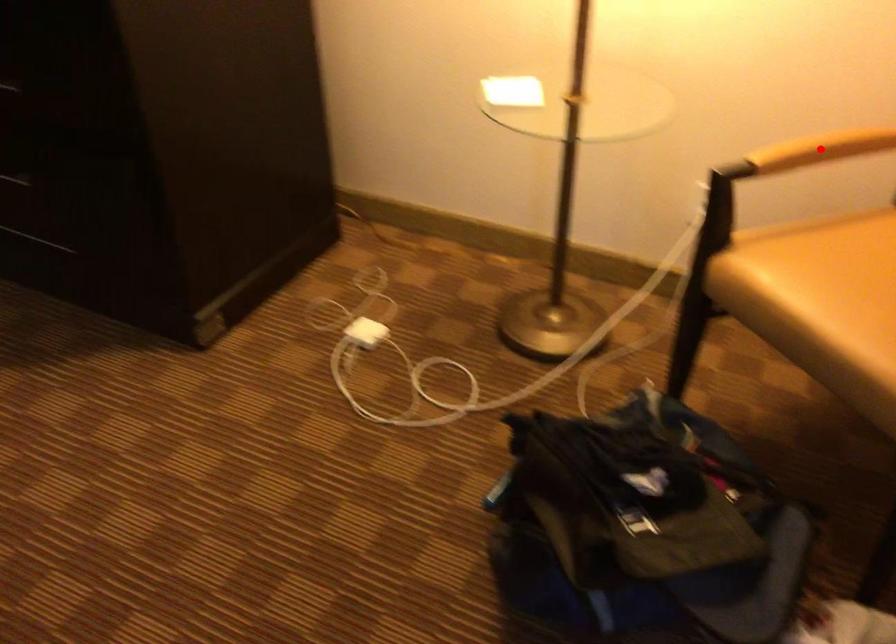
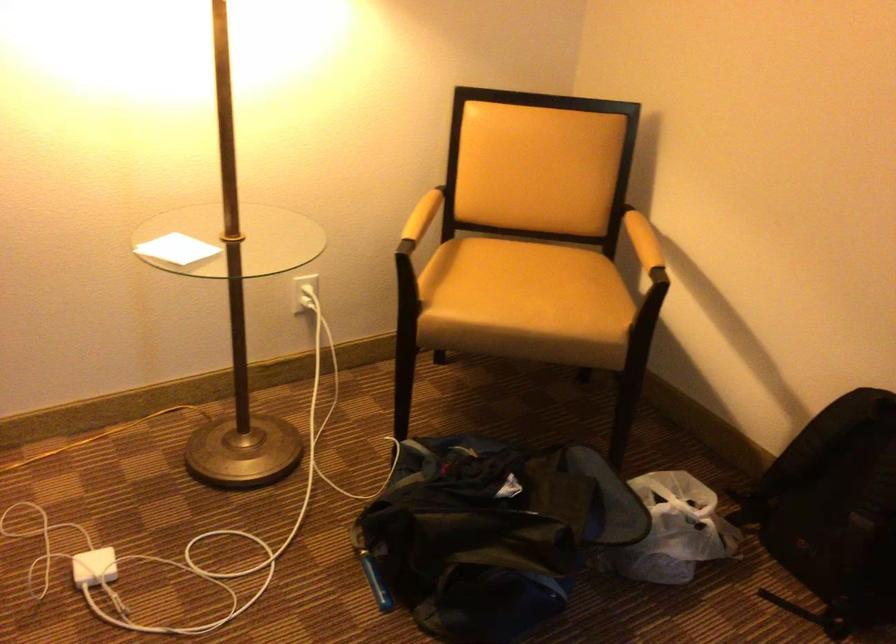
Question: I am providing you with two images of the same scene from different viewpoints. Image1 has a red point marked. In image2, the corresponding 3D location appears at what relative position? Reply with the corresponding letter.

Choices:
 (A) Closer
 (B) Farther

Answer: (B)